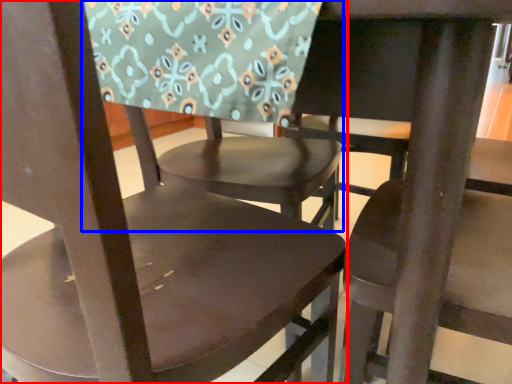
Question: Which object is further to the camera taking this photo, chair (highlighted by a red box) or chair (highlighted by a blue box)?

Choices:
 (A) chair
 (B) chair

Answer: (B)